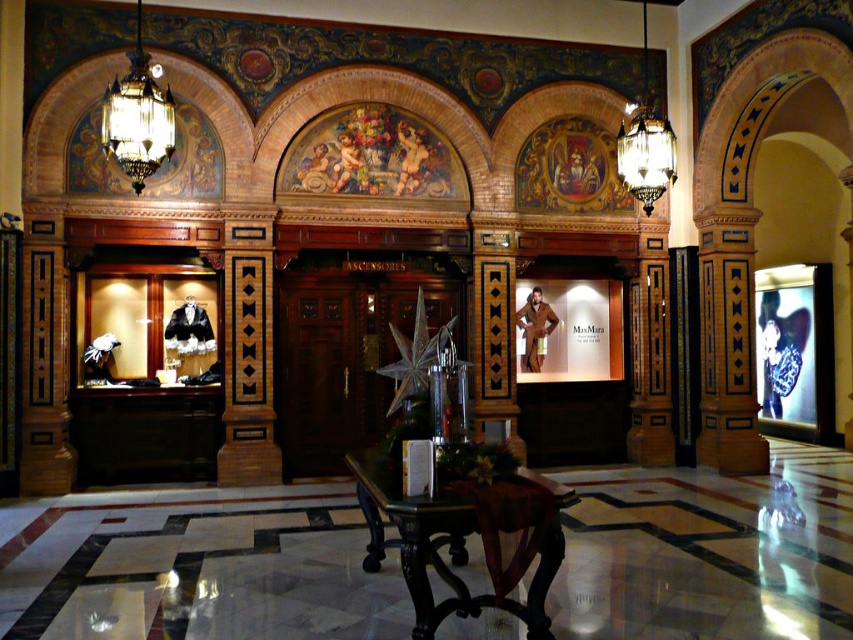
What is the spatial relationship between the dark wood table at center and the glass crystal chandelier at upper left in the grand interior?

The dark wood table at center is located to the right of the glass crystal chandelier at upper left.

You are a guest staying at this hotel and you want to place your brown leather jacket at center on the dark wood table at center. Can you put it there without moving anything else?

The dark wood table at center is in front of the brown leather jacket at center, so the jacket is already placed on the table. Therefore, you don not need to move anything else to place it there.